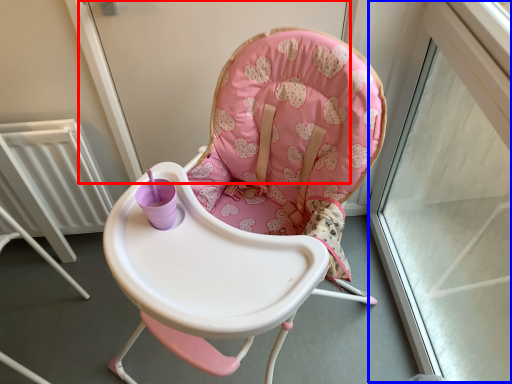
Question: Which of the following is the closest to the observer, screen door (highlighted by a red box) or window frame (highlighted by a blue box)?

Choices:
 (A) screen door
 (B) window frame

Answer: (B)